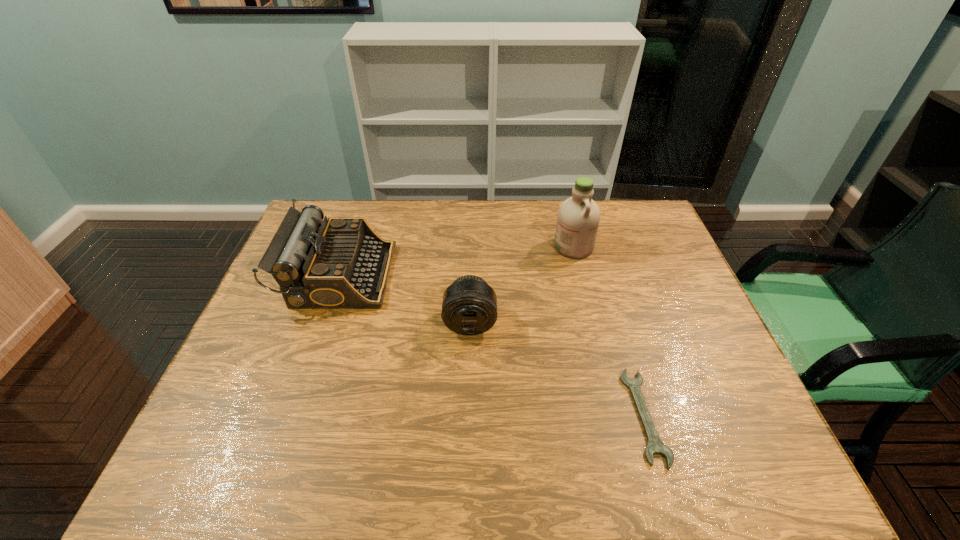
You are a GUI agent. You are given a task and a screenshot of the screen. Output one action in this format:
    pyautogui.click(x=<x>, y=<y>)
    Task: Click on the free space located on the keyboard of the second tallest object
    Image resolution: width=960 pixels, height=540 pixels.
    Given the screenshot: What is the action you would take?
    pyautogui.click(x=453, y=275)

What are the coordinates of `free space located 0.070m on the front-facing side of the second object from left to right` in the screenshot? It's located at (469, 362).

Locate an element on the screen. free space located on the back of the shortest object is located at coordinates (626, 355).

What are the coordinates of `cleansing agent at the far edge` in the screenshot? It's located at (578, 218).

Where is `typewriter that is at the far edge`? The image size is (960, 540). typewriter that is at the far edge is located at coordinates (341, 263).

Where is `object situated at the near edge`? object situated at the near edge is located at coordinates (655, 446).

You are a GUI agent. You are given a task and a screenshot of the screen. Output one action in this format:
    pyautogui.click(x=<x>, y=<y>)
    Task: Click on the object at the left edge
    The height and width of the screenshot is (540, 960).
    Given the screenshot: What is the action you would take?
    pyautogui.click(x=341, y=263)

At what (x,y) coordinates should I click in order to perform the action: click on object positioned at the far left corner. Please return your answer as a coordinate pair (x, y). Looking at the image, I should click on (341, 263).

The width and height of the screenshot is (960, 540). Find the location of `blank space at the far edge of the desktop`. blank space at the far edge of the desktop is located at coordinates (502, 209).

Image resolution: width=960 pixels, height=540 pixels. What are the coordinates of `free space at the near edge of the desktop` in the screenshot? It's located at (497, 450).